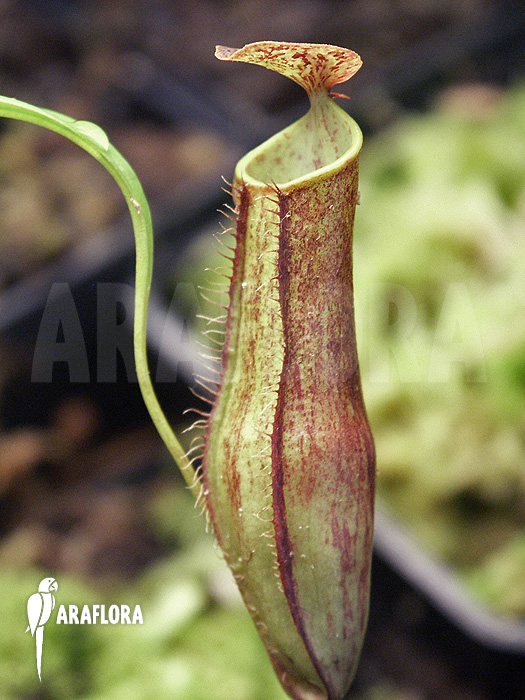
You are a GUI agent. You are given a task and a screenshot of the screen. Output one action in this format:
    pyautogui.click(x=<x>, y=<y>)
    Task: Click on the plant
    
    Given the screenshot: What is the action you would take?
    pyautogui.click(x=293, y=374)